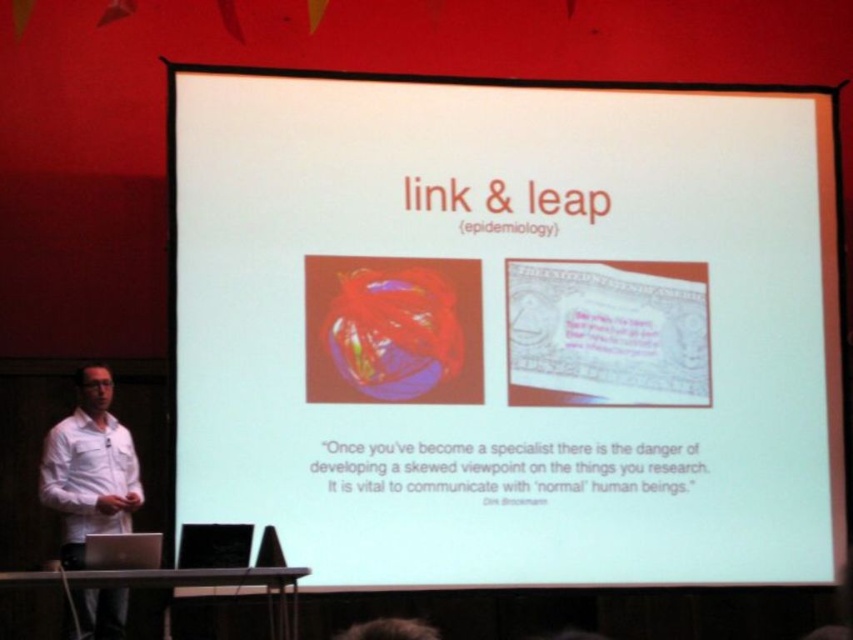
You are an attendee at the presentation. You notice two white items in the scene. Which one is closer to you, the white paper at center or the white shirt at left?

The white paper at center is closer to you since it is further to the viewer than the white shirt at left.

You are a photographer adjusting the focus on your camera. You notice two points in the scene labeled as point (490,362) and point (103,419). Which point should you focus on first to ensure the foreground is sharp?

You should focus on point (103,419) first because it is closer to the camera than point (490,362), making it part of the foreground.